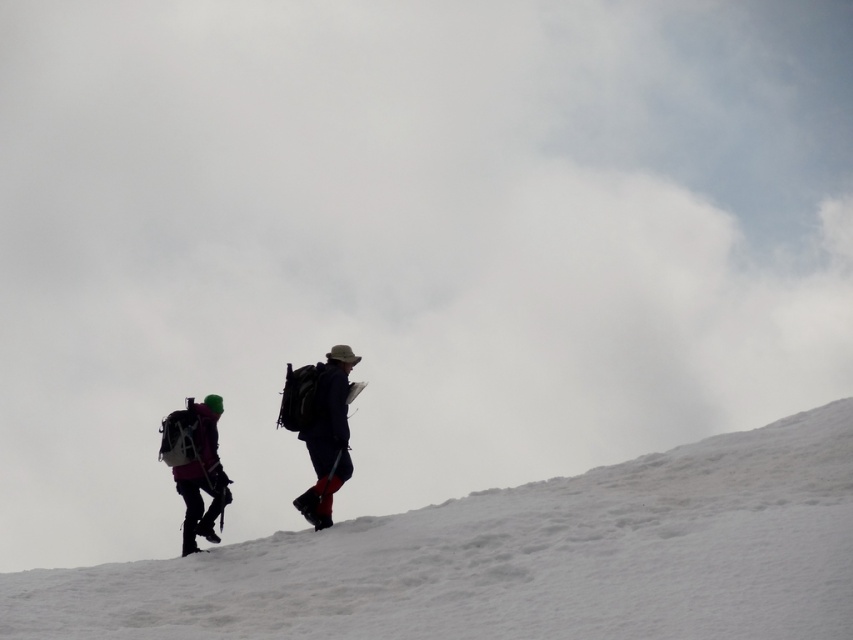
Question: Can you confirm if matte pink jacket at left is positioned to the right of dark blue fabric backpack at center?

Choices:
 (A) no
 (B) yes

Answer: (A)

Question: Is matte pink jacket at center positioned at the back of dark blue fabric backpack at center?

Choices:
 (A) no
 (B) yes

Answer: (A)

Question: Which is nearer to the matte pink jacket at center?

Choices:
 (A) matte pink jacket at left
 (B) white powdery snow at center
 (C) dark blue fabric backpack at center

Answer: (C)

Question: Which object appears closest to the camera in this image?

Choices:
 (A) matte pink jacket at center
 (B) white powdery snow at center
 (C) dark blue fabric backpack at center

Answer: (B)

Question: Can you confirm if matte pink jacket at center is positioned above matte pink jacket at left?

Choices:
 (A) no
 (B) yes

Answer: (B)

Question: Among these objects, which one is nearest to the camera?

Choices:
 (A) white powdery snow at center
 (B) matte pink jacket at center
 (C) dark blue fabric backpack at center
 (D) matte pink jacket at left

Answer: (A)